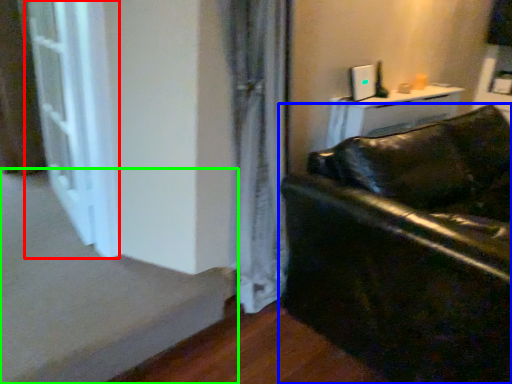
Question: Estimate the real-world distances between objects in this image. Which object is farther from screen door (highlighted by a red box), studio couch (highlighted by a blue box) or stairwell (highlighted by a green box)?

Choices:
 (A) studio couch
 (B) stairwell

Answer: (A)